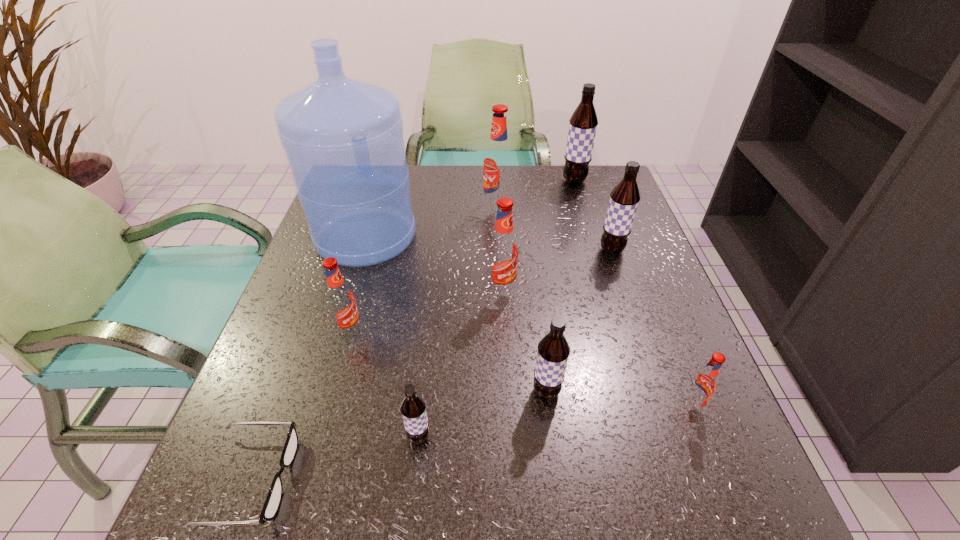
The width and height of the screenshot is (960, 540). I want to click on the tallest object, so click(343, 138).

The image size is (960, 540). Identify the location of blue water jug. (343, 138).

Find the location of a particular element. the farthest brown root beer is located at coordinates (583, 123).

The height and width of the screenshot is (540, 960). What are the coordinates of `the farthest object` in the screenshot? It's located at (583, 123).

At what (x,y) coordinates should I click in order to perform the action: click on the second farthest root beer. Please return your answer as a coordinate pair (x, y). The width and height of the screenshot is (960, 540). Looking at the image, I should click on (498, 159).

Find the location of `the farthest red root beer`. the farthest red root beer is located at coordinates (498, 159).

This screenshot has height=540, width=960. What are the coordinates of `the sixth nearest root beer` in the screenshot? It's located at (624, 198).

You are a GUI agent. You are given a task and a screenshot of the screen. Output one action in this format:
    pyautogui.click(x=<x>, y=<y>)
    Task: Click on the third smallest brown root beer
    This screenshot has height=540, width=960.
    Given the screenshot: What is the action you would take?
    pyautogui.click(x=624, y=198)

You are a GUI agent. You are given a task and a screenshot of the screen. Output one action in this format:
    pyautogui.click(x=<x>, y=<y>)
    Task: Click on the fourth farthest root beer
    Image resolution: width=960 pixels, height=540 pixels.
    Given the screenshot: What is the action you would take?
    pyautogui.click(x=502, y=254)

At what (x,y) coordinates should I click in order to perform the action: click on the third nearest red root beer. Please return your answer as a coordinate pair (x, y). This screenshot has width=960, height=540. Looking at the image, I should click on (502, 254).